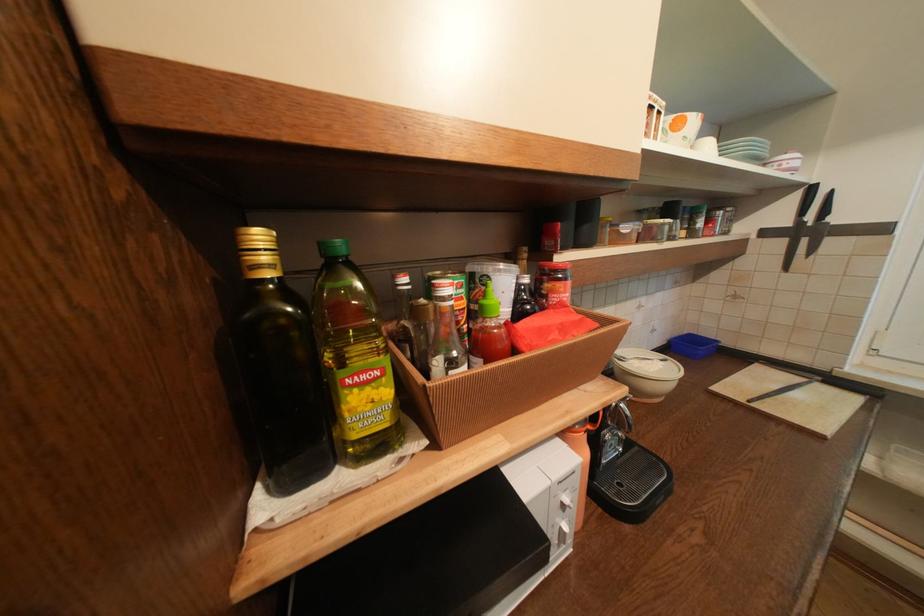
In order to click on dark glass bottle in this screenshot , I will do `click(273, 368)`.